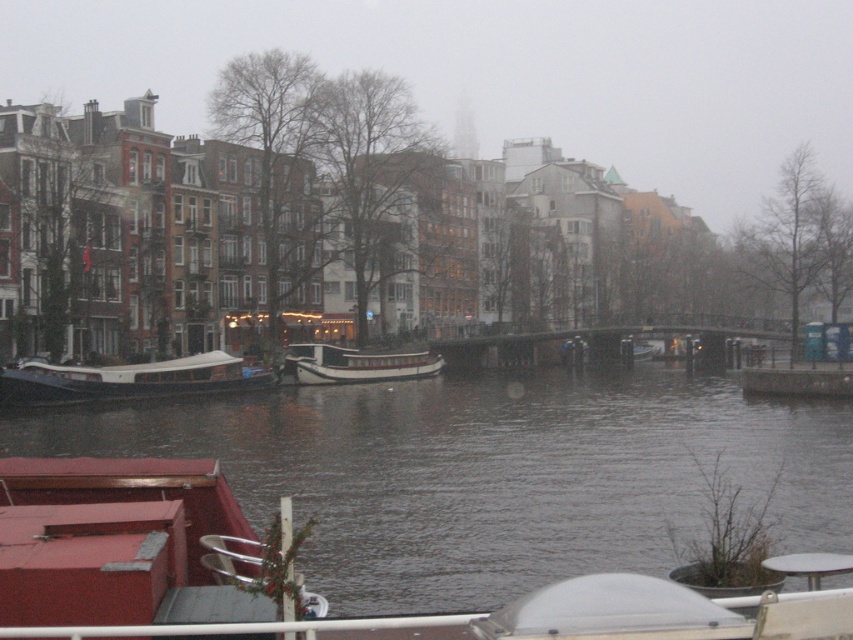
You are standing on the dock and see the wooden polished boat at left and the white wooden boat at center. Which boat is positioned closer to the left side of the canal?

The wooden polished boat at left is positioned closer to the left side of the canal as it is to the left of the white wooden boat at center.

You are a tourist standing on the dock and want to take a photo of the dark gray water at center and the white wooden boat at center. Which one is higher in the frame?

The dark gray water at center is taller than the white wooden boat at center, so it will appear higher in the frame.

You are a tourist standing on the dock and want to take a photo of the dark gray water at center and the wooden polished boat at left. Which object will occupy more space in your photo?

The dark gray water at center will occupy more space in the photo because it is bigger than the wooden polished boat at left.